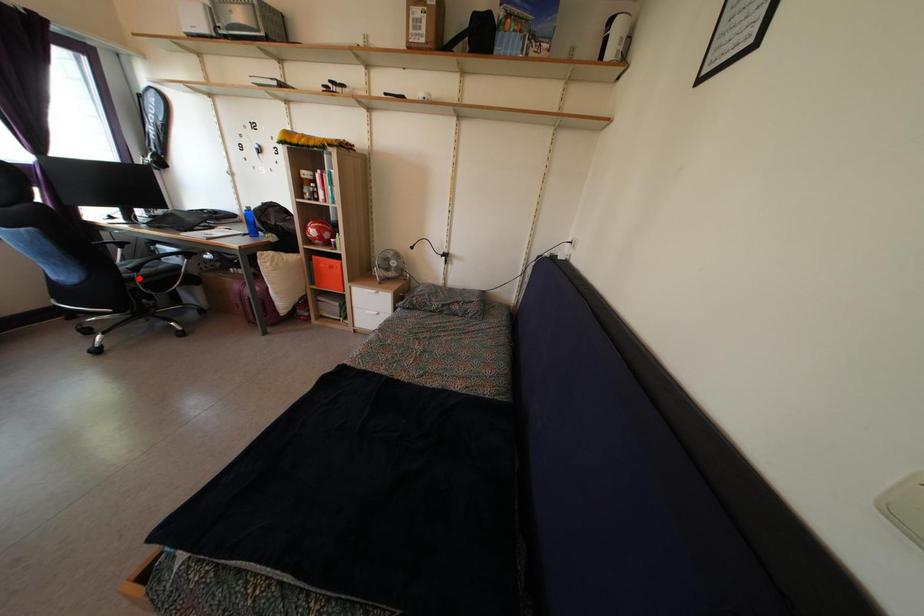
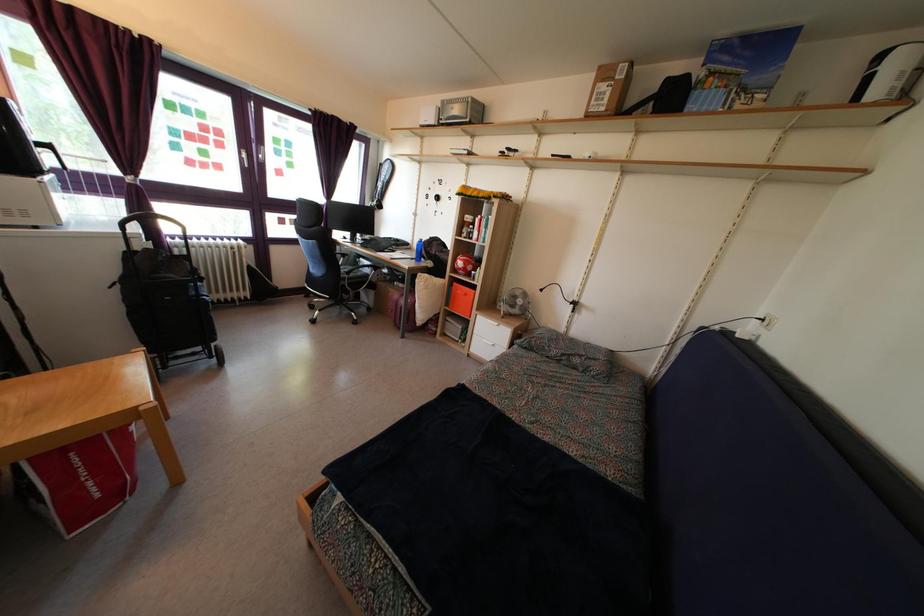
Question: I am providing you with two images of the same scene from different viewpoints. Given a red point in image1, look at the same physical point in image2. Is it:

Choices:
 (A) Closer to the viewpoint
 (B) Farther from the viewpoint

Answer: (A)